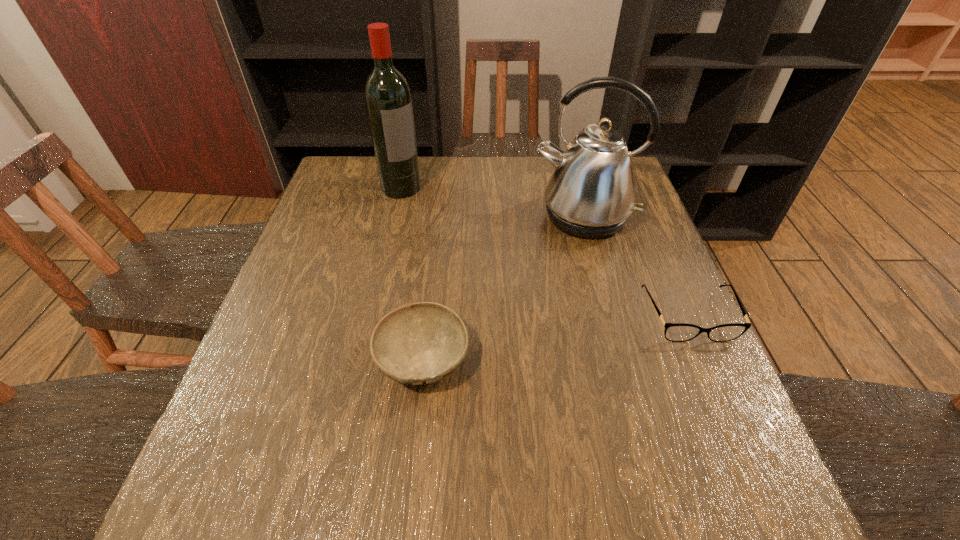
This screenshot has width=960, height=540. Find the location of `the second shortest object`. the second shortest object is located at coordinates (420, 343).

Locate an element on the screen. The height and width of the screenshot is (540, 960). spectacles is located at coordinates (676, 332).

You are a GUI agent. You are given a task and a screenshot of the screen. Output one action in this format:
    pyautogui.click(x=<x>, y=<y>)
    Task: Click on the wine bottle
    
    Given the screenshot: What is the action you would take?
    pyautogui.click(x=388, y=100)

Where is `the second tallest object`? This screenshot has height=540, width=960. the second tallest object is located at coordinates (591, 194).

I want to click on vacant area situated on the left of the third tallest object, so click(x=341, y=359).

Where is `vacant space located on the front-facing side of the shortest object`? The image size is (960, 540). vacant space located on the front-facing side of the shortest object is located at coordinates (726, 404).

This screenshot has width=960, height=540. In order to click on free space located on the label of the wine bottle in this screenshot , I will do `click(441, 230)`.

Find the location of a particular element. The width and height of the screenshot is (960, 540). free location located on the label of the wine bottle is located at coordinates (420, 207).

This screenshot has height=540, width=960. Identify the location of free point located 0.180m on the label of the wine bottle. (441, 230).

Locate an element on the screen. vacant position located from the spout of the kettle is located at coordinates (555, 329).